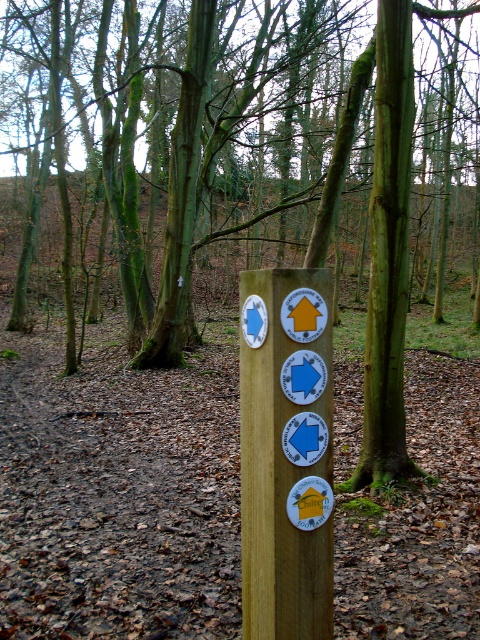
Which of these two, green mossy tree at center or wooden signpost at center, stands taller?

With more height is green mossy tree at center.

Identify the location of green mossy tree at center. The width and height of the screenshot is (480, 640). (168, 150).

Is point (83, 244) closer to camera compared to point (302, 541)?

No, it is behind (302, 541).

This screenshot has height=640, width=480. I want to click on green mossy tree at center, so click(168, 150).